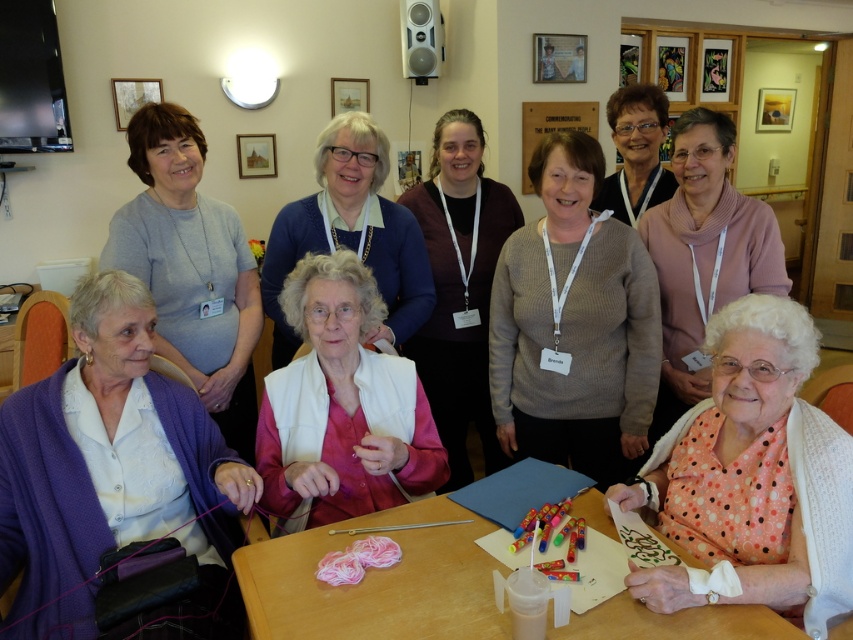
You are a photographer trying to capture a photo of the gray matte sweater at left and the pink dotted sweater at lower right. To ensure both are in the frame, should you position your camera to the left or the right of the two sweaters?

To include both the gray matte sweater at left and the pink dotted sweater at lower right in the frame, position your camera to the right. This way, the gray matte sweater at left, which is to the left of the pink dotted sweater at lower right, will remain in view.